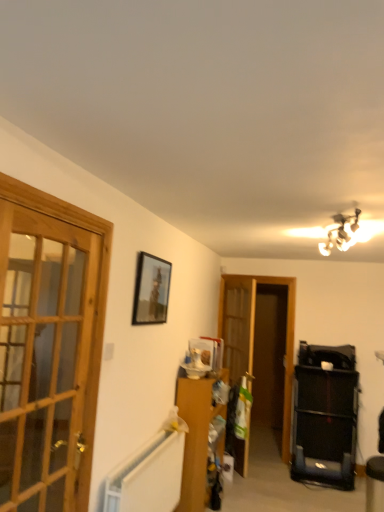
Question: Does metallic chandelier at upper right have a lesser height compared to wooden cabinet at center?

Choices:
 (A) no
 (B) yes

Answer: (B)

Question: Is metallic chandelier at upper right facing away from wooden cabinet at center?

Choices:
 (A) no
 (B) yes

Answer: (A)

Question: Considering the relative sizes of metallic chandelier at upper right and wooden cabinet at center in the image provided, is metallic chandelier at upper right bigger than wooden cabinet at center?

Choices:
 (A) yes
 (B) no

Answer: (B)

Question: Is metallic chandelier at upper right smaller than wooden cabinet at center?

Choices:
 (A) yes
 (B) no

Answer: (A)

Question: Can you confirm if metallic chandelier at upper right is positioned to the left of wooden cabinet at center?

Choices:
 (A) yes
 (B) no

Answer: (B)

Question: Is point (x=248, y=329) positioned closer to the camera than point (x=77, y=354)?

Choices:
 (A) farther
 (B) closer

Answer: (A)

Question: From a real-world perspective, is translucent wood screen door at center positioned above or below wooden glass door at left?

Choices:
 (A) below
 (B) above

Answer: (A)

Question: Considering the positions of translucent wood screen door at center and wooden glass door at left in the image, is translucent wood screen door at center bigger or smaller than wooden glass door at left?

Choices:
 (A) big
 (B) small

Answer: (A)

Question: Considering the positions of translucent wood screen door at center and wooden glass door at left in the image, is translucent wood screen door at center wider or thinner than wooden glass door at left?

Choices:
 (A) thin
 (B) wide

Answer: (B)

Question: From the image's perspective, is wooden cabinet at center above or below wooden glass door at left?

Choices:
 (A) below
 (B) above

Answer: (A)

Question: Based on their sizes in the image, would you say wooden cabinet at center is bigger or smaller than wooden glass door at left?

Choices:
 (A) small
 (B) big

Answer: (B)

Question: From a real-world perspective, is wooden cabinet at center above or below wooden glass door at left?

Choices:
 (A) above
 (B) below

Answer: (B)

Question: Considering the positions of wooden cabinet at center and wooden glass door at left in the image, is wooden cabinet at center taller or shorter than wooden glass door at left?

Choices:
 (A) short
 (B) tall

Answer: (A)

Question: Is point (188, 392) closer or farther from the camera than point (326, 242)?

Choices:
 (A) closer
 (B) farther

Answer: (B)

Question: Considering the positions of wooden cabinet at center and metallic chandelier at upper right in the image, is wooden cabinet at center wider or thinner than metallic chandelier at upper right?

Choices:
 (A) thin
 (B) wide

Answer: (A)